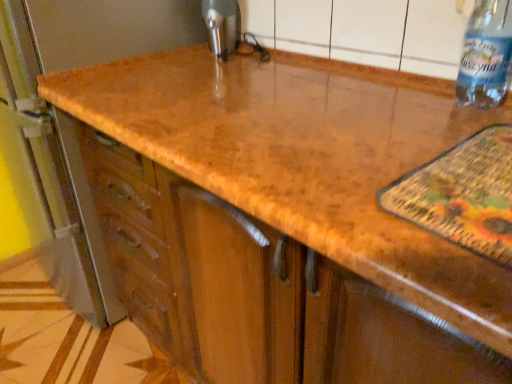
Question: Considering the positions of metallic faucet at upper center and transparent plastic bottle at upper right in the image, is metallic faucet at upper center bigger or smaller than transparent plastic bottle at upper right?

Choices:
 (A) small
 (B) big

Answer: (A)

Question: Considering the positions of point (228, 1) and point (493, 100), is point (228, 1) closer or farther from the camera than point (493, 100)?

Choices:
 (A) closer
 (B) farther

Answer: (B)

Question: In terms of height, does metallic faucet at upper center look taller or shorter compared to transparent plastic bottle at upper right?

Choices:
 (A) short
 (B) tall

Answer: (A)

Question: Is point (500, 86) positioned closer to the camera than point (225, 39)?

Choices:
 (A) closer
 (B) farther

Answer: (A)

Question: From a real-world perspective, is transparent plastic bottle at upper right physically located above or below metallic faucet at upper center?

Choices:
 (A) above
 (B) below

Answer: (A)

Question: Based on their sizes in the image, would you say transparent plastic bottle at upper right is bigger or smaller than metallic faucet at upper center?

Choices:
 (A) big
 (B) small

Answer: (A)

Question: In the image, is transparent plastic bottle at upper right positioned in front of or behind metallic faucet at upper center?

Choices:
 (A) behind
 (B) front

Answer: (B)